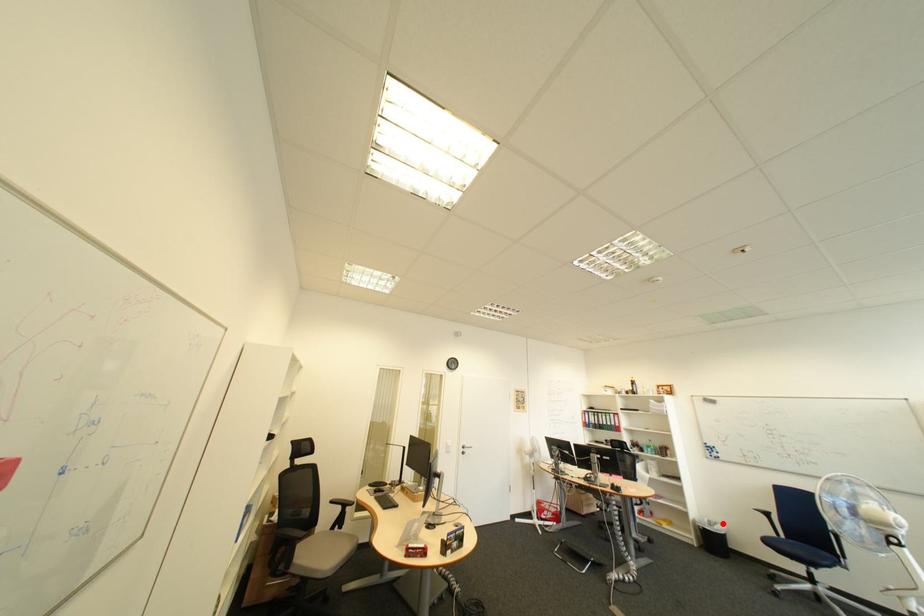
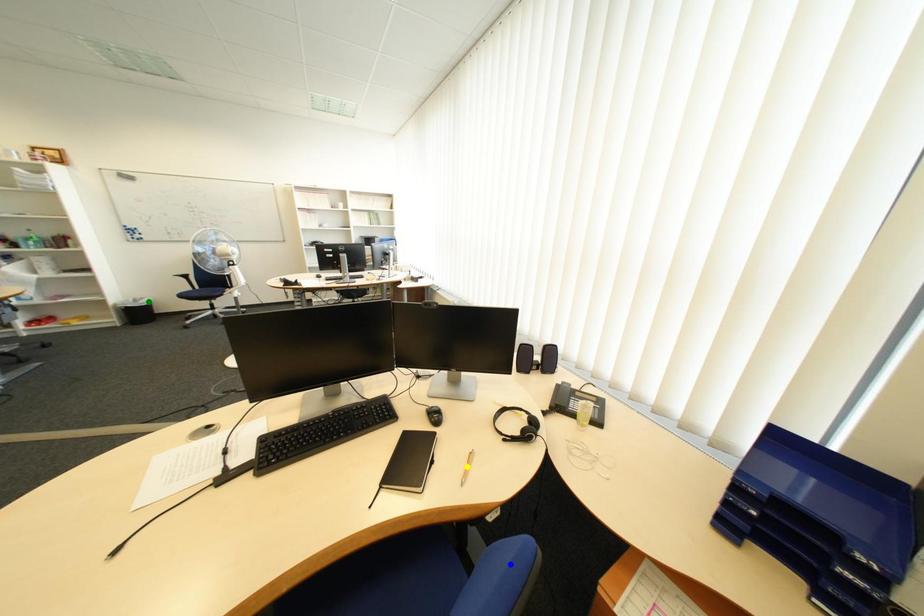
Question: I am providing you with two images of the same scene from different viewpoints. A red point is marked on the first image. You are given multiple points on the second image. In image 2, which mark is for the same physical point as the one in image 1?

Choices:
 (A) blue point
 (B) yellow point
 (C) green point

Answer: (C)